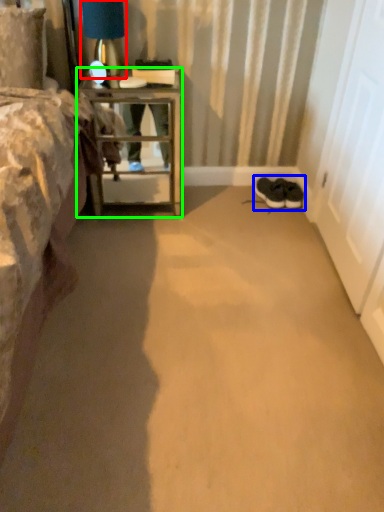
Question: Considering the real-world distances, which object is farthest from table lamp (highlighted by a red box)? footwear (highlighted by a blue box) or nightstand (highlighted by a green box)?

Choices:
 (A) footwear
 (B) nightstand

Answer: (A)